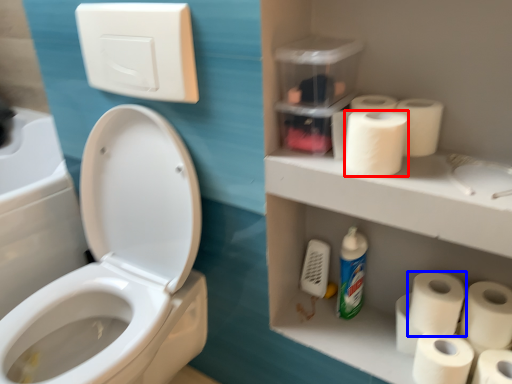
Question: Which of the following is the closest to the observer, toilet paper (highlighted by a red box) or toilet paper (highlighted by a blue box)?

Choices:
 (A) toilet paper
 (B) toilet paper

Answer: (A)